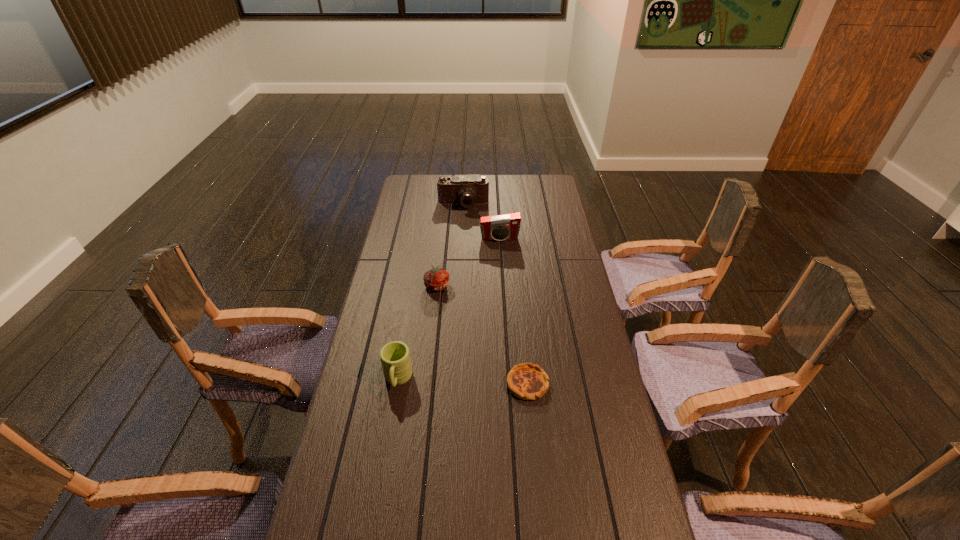
Locate an element on the screen. The height and width of the screenshot is (540, 960). vacant space located 0.310m on the back of the shortest object is located at coordinates (519, 297).

You are a GUI agent. You are given a task and a screenshot of the screen. Output one action in this format:
    pyautogui.click(x=<x>, y=<y>)
    Task: Click on the object located in the far edge section of the desktop
    Image resolution: width=960 pixels, height=540 pixels.
    Given the screenshot: What is the action you would take?
    pyautogui.click(x=468, y=190)

In order to click on object situated at the left edge in this screenshot , I will do `click(395, 358)`.

The height and width of the screenshot is (540, 960). In the image, there is a desktop. Identify the location of vacant space at the left edge. click(x=363, y=475).

In the image, there is a desktop. Identify the location of vacant space at the right edge. Image resolution: width=960 pixels, height=540 pixels. (590, 409).

Image resolution: width=960 pixels, height=540 pixels. I want to click on free spot at the far left corner of the desktop, so click(x=435, y=185).

Locate an element on the screen. The image size is (960, 540). unoccupied area between the farthest object and the mug is located at coordinates (430, 292).

This screenshot has height=540, width=960. I want to click on empty location between the mug and the farthest object, so click(x=430, y=292).

Where is `vacant area between the nearer camera and the second shortest object`? Image resolution: width=960 pixels, height=540 pixels. vacant area between the nearer camera and the second shortest object is located at coordinates (468, 262).

This screenshot has height=540, width=960. What are the coordinates of `empty space that is in between the quiche and the farther camera` in the screenshot? It's located at (495, 294).